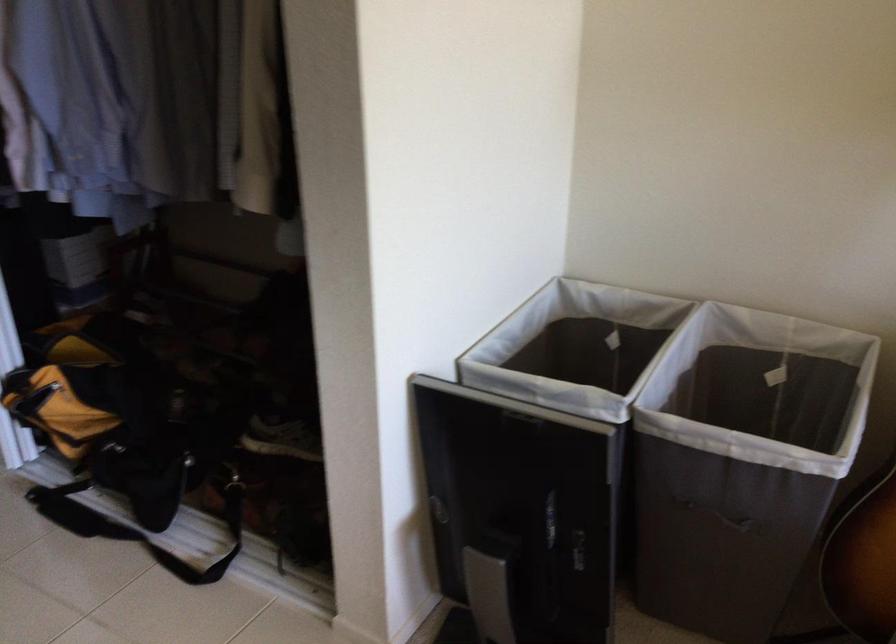
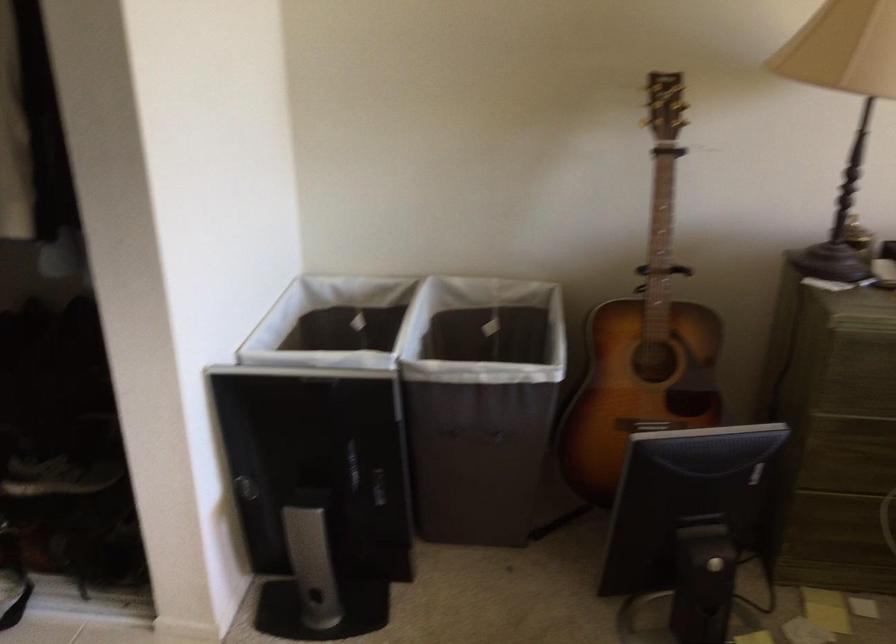
Which direction would the cameraman need to move to produce the second image?

The cameraman walked toward left, backward.